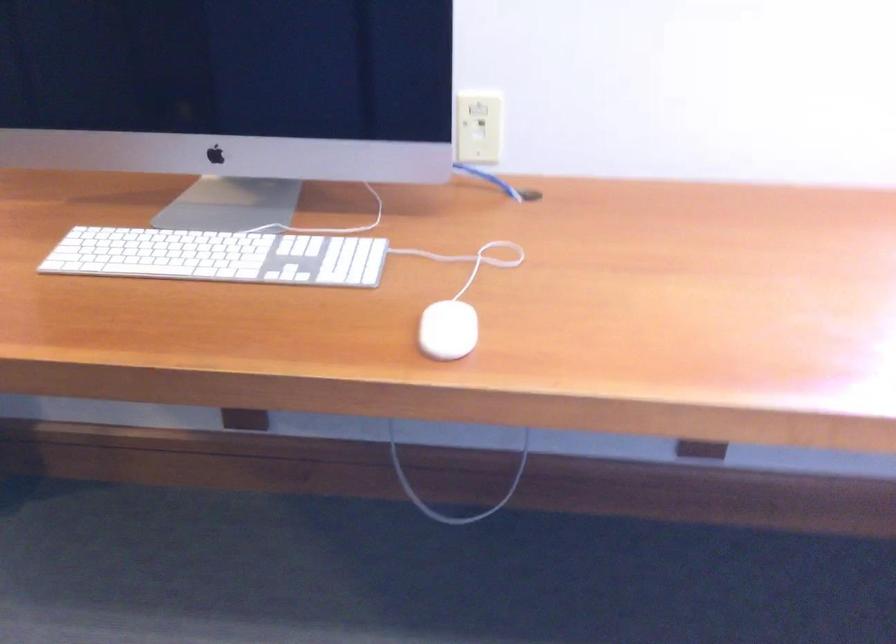
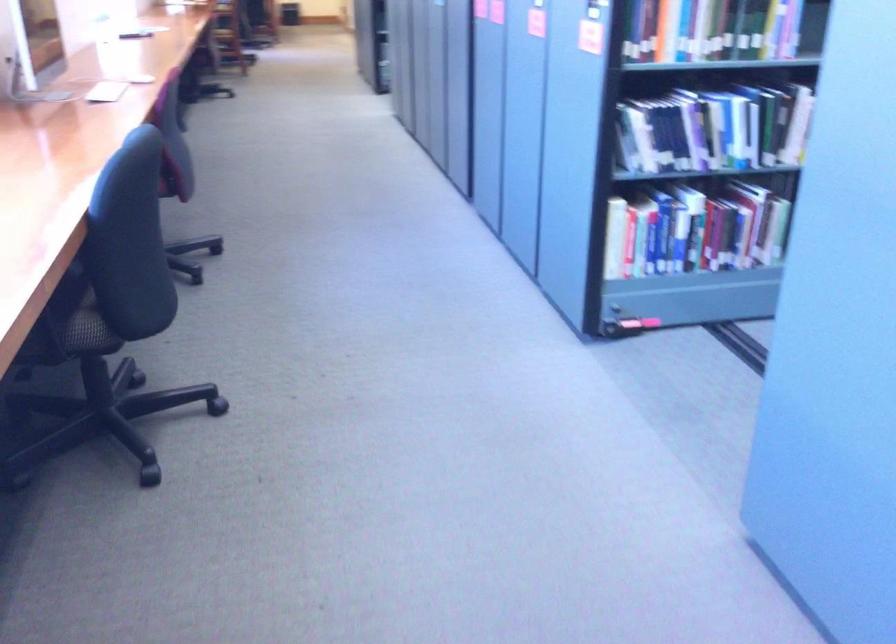
The first image is from the beginning of the video and the second image is from the end. How did the camera likely rotate when shooting the video?

The camera rotated toward right-down.